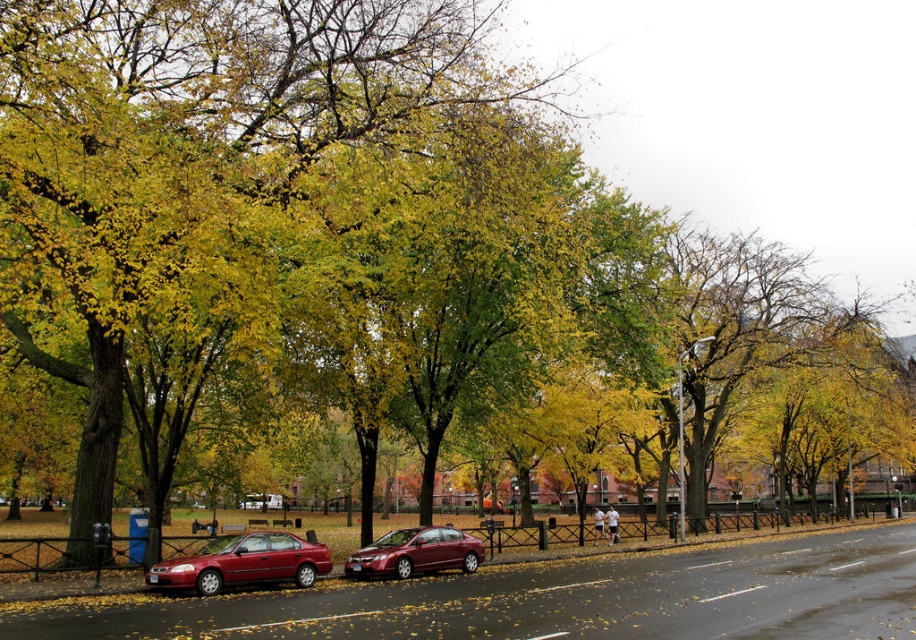
Is shiny red sedan at center smaller than glossy metallic sedan at center?

Yes.

Measure the distance between shiny red sedan at center and glossy metallic sedan at center.

shiny red sedan at center is 21.88 feet away from glossy metallic sedan at center.

Which is behind, point (293, 548) or point (385, 552)?

Point (385, 552)

The image size is (916, 640). In order to click on shiny red sedan at center in this screenshot , I will do `click(244, 563)`.